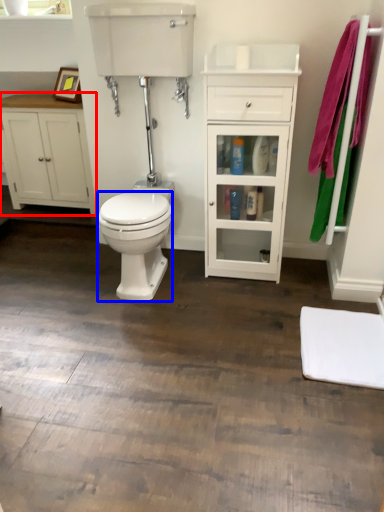
Question: Which of the following is the closest to the observer, bathroom cabinet (highlighted by a red box) or bidet (highlighted by a blue box)?

Choices:
 (A) bathroom cabinet
 (B) bidet

Answer: (B)